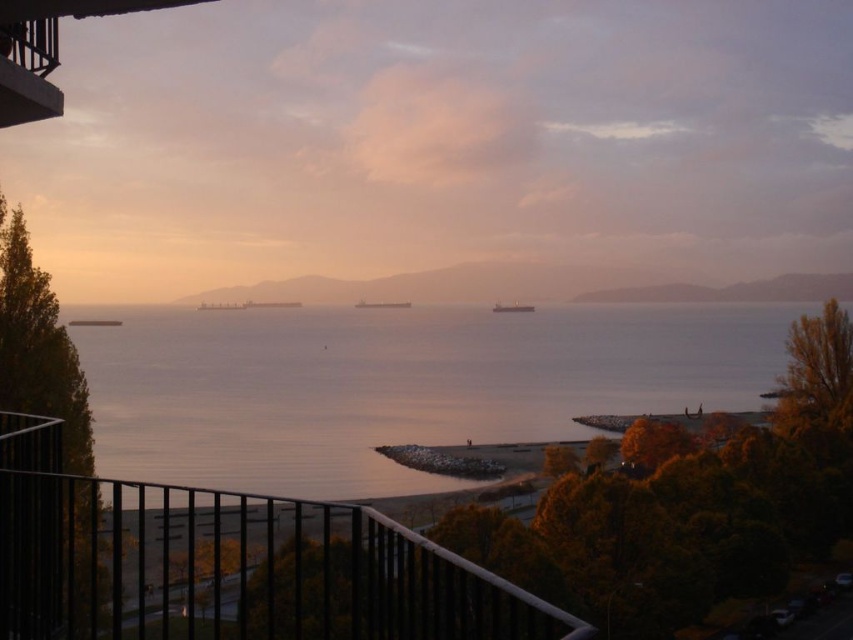
Which is above, black metal railing at lower left or metallic gray ship at center?

metallic gray ship at center is above.

Who is lower down, black metal railing at lower left or metallic gray ship at center?

black metal railing at lower left is below.

Which is in front, point (213, 536) or point (494, 301)?

Point (213, 536) is more forward.

I want to click on black metal railing at lower left, so click(227, 563).

Does black metal balcony at upper left appear under matte gray ship at center?

Yes.

Can you confirm if black metal balcony at upper left is taller than matte gray ship at center?

No.

Find the location of `black metal balcony at upper left`. black metal balcony at upper left is located at coordinates (28, 70).

Is the position of black metal railing at lower left more distant than that of black metal balcony at upper left?

No, black metal railing at lower left is in front of black metal balcony at upper left.

Find the location of a particular element. The image size is (853, 640). black metal railing at lower left is located at coordinates (227, 563).

At what (x,y) coordinates should I click in order to perform the action: click on black metal railing at lower left. Please return your answer as a coordinate pair (x, y). Looking at the image, I should click on (227, 563).

Locate an element on the screen. This screenshot has width=853, height=640. black metal railing at lower left is located at coordinates (227, 563).